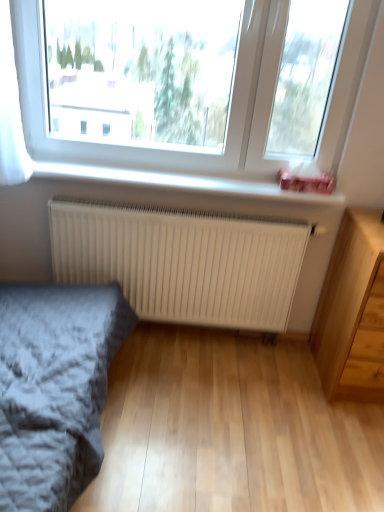
Where is `vacant space in front of white matte radiator at center`? The height and width of the screenshot is (512, 384). vacant space in front of white matte radiator at center is located at coordinates (192, 407).